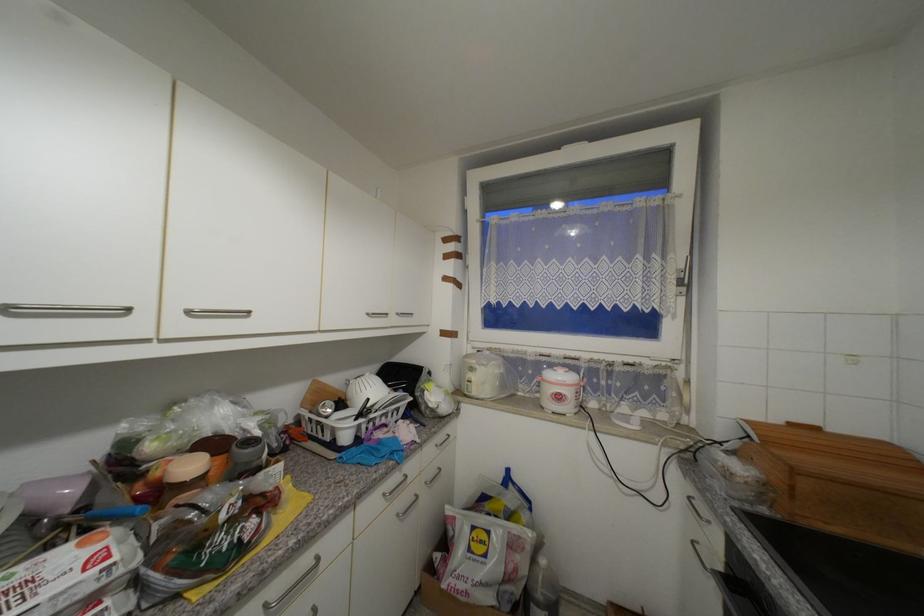
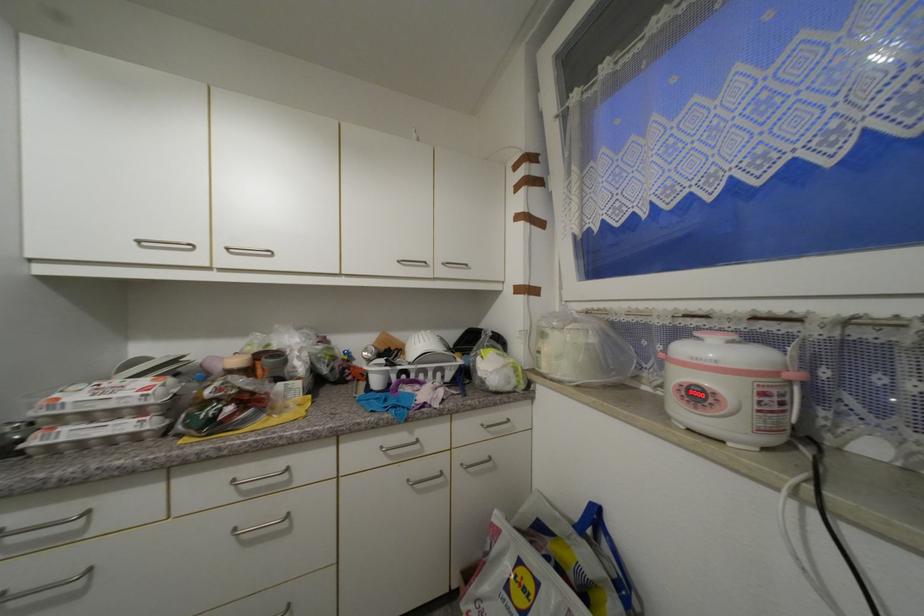
Where in the second image is the point corresponding to (x=432, y=484) from the first image?

(468, 467)